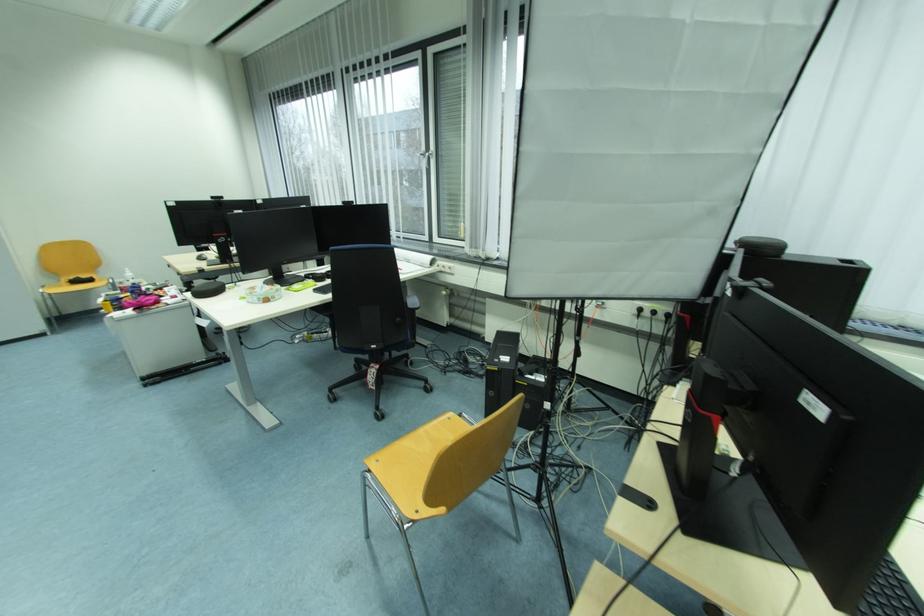
The height and width of the screenshot is (616, 924). In order to click on power strip switch in this screenshot , I will do `click(647, 309)`.